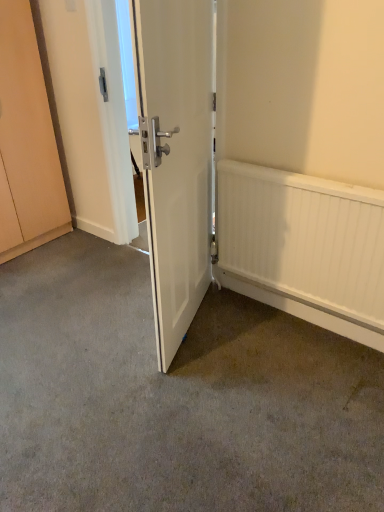
Question: Is white textured radiator at right inside the boundaries of white matte door at center, or outside?

Choices:
 (A) outside
 (B) inside

Answer: (A)

Question: In terms of height, does white textured radiator at right look taller or shorter compared to white matte door at center?

Choices:
 (A) short
 (B) tall

Answer: (A)

Question: Which object is positioned farthest from the white textured radiator at right?

Choices:
 (A) white matte door at center
 (B) gray carpet at center
 (C) matte wood cabinet at left

Answer: (C)

Question: Which of these objects is positioned closest to the white matte door at center?

Choices:
 (A) matte wood cabinet at left
 (B) white textured radiator at right
 (C) gray carpet at center

Answer: (B)